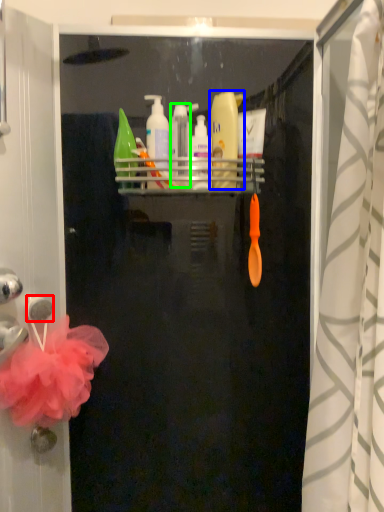
Question: Considering the real-world distances, which object is farthest from towel bar (highlighted by a red box)? cleaning product (highlighted by a blue box) or toiletry (highlighted by a green box)?

Choices:
 (A) cleaning product
 (B) toiletry

Answer: (A)